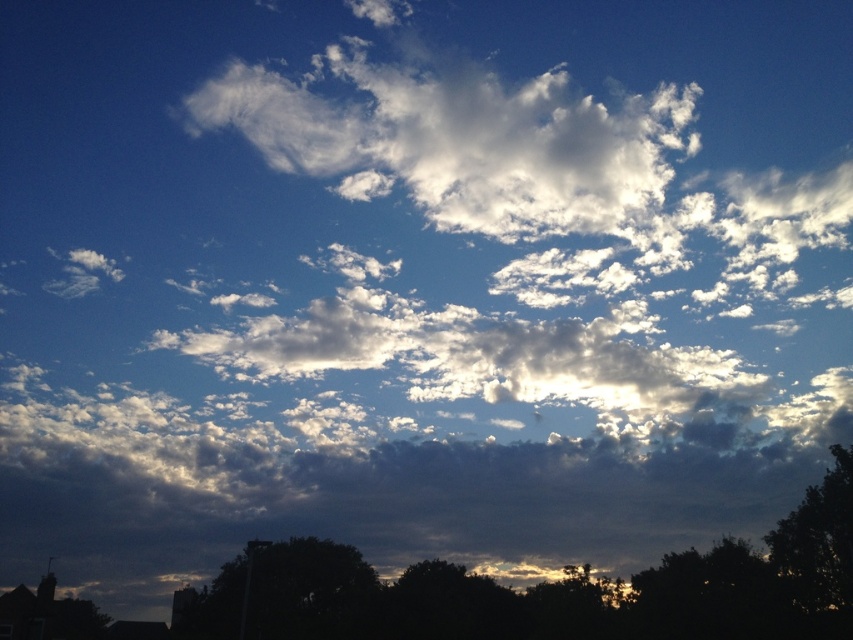
Question: Can you confirm if dark green leafy tree at lower left is positioned to the left of dark green leafy tree at lower center?

Choices:
 (A) no
 (B) yes

Answer: (A)

Question: Which point is farther to the camera?

Choices:
 (A) dark green leafy tree at lower right
 (B) dark green leafy tree at lower center
 (C) dark green leafy tree at lower left

Answer: (B)

Question: Considering the real-world distances, which object is farthest from the dark green leafy tree at lower right?

Choices:
 (A) dark green leafy tree at lower center
 (B) dark green leafy tree at lower left

Answer: (A)

Question: Which object is closer to the camera taking this photo?

Choices:
 (A) dark green leafy tree at lower left
 (B) dark green leafy tree at lower center

Answer: (A)

Question: Does dark green leafy tree at lower left come behind dark green leafy tree at lower right?

Choices:
 (A) yes
 (B) no

Answer: (B)

Question: Observing the image, what is the correct spatial positioning of dark green leafy tree at lower left in reference to dark green leafy tree at lower center?

Choices:
 (A) below
 (B) above

Answer: (B)